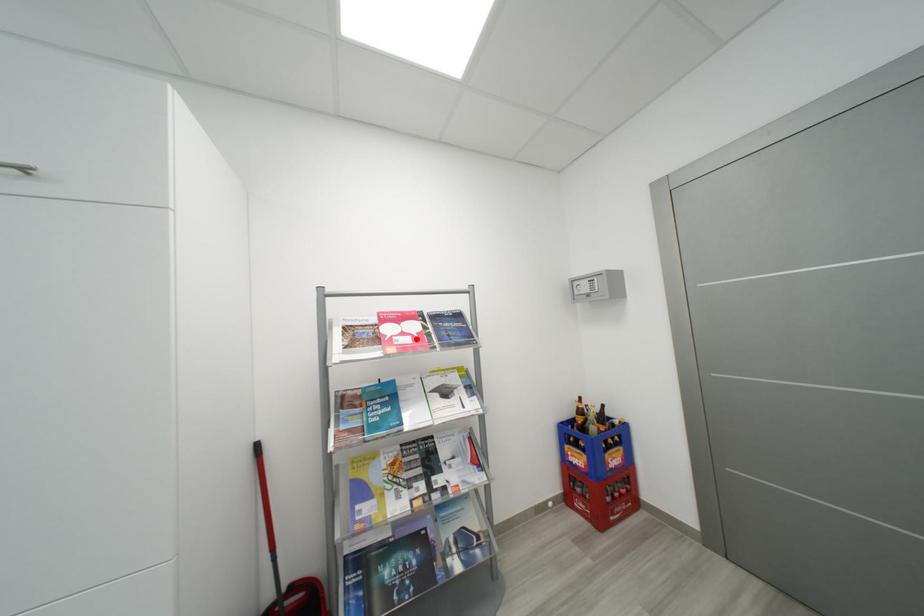
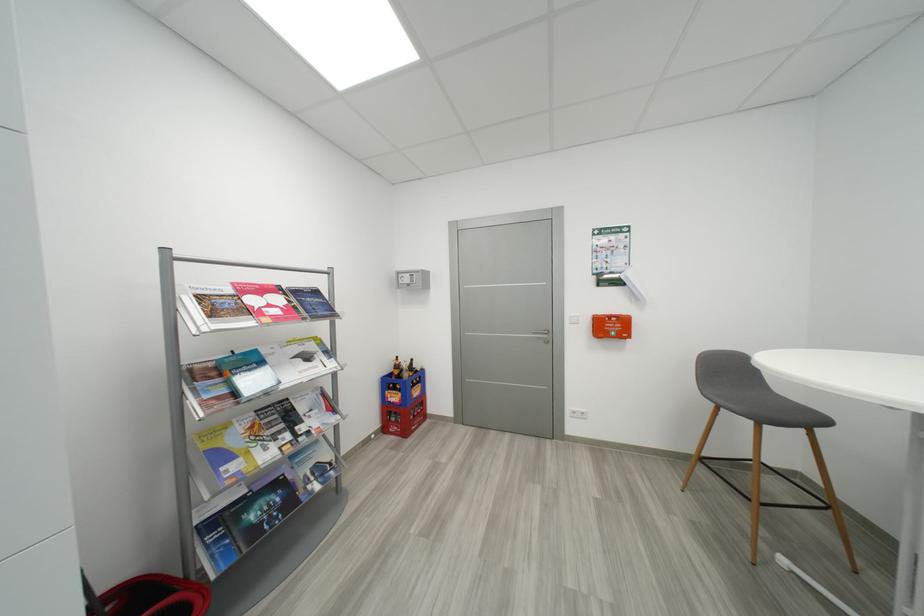
In the second image, find the point that corresponds to the highlighted location in the first image.

(286, 310)